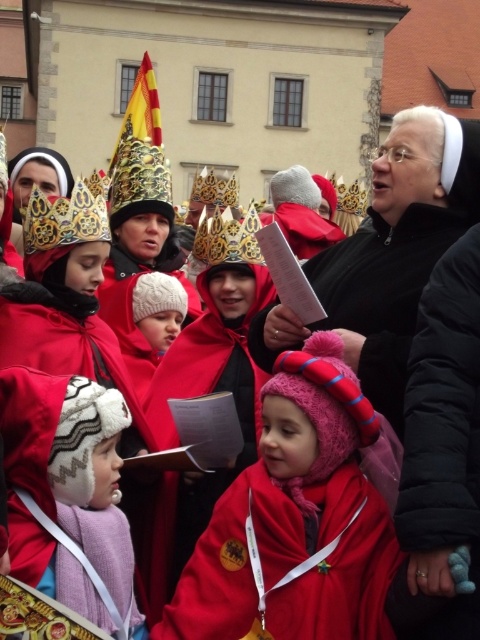
Does fuzzy white hat at lower left have a lesser height compared to gold metallic crown at upper left?

Correct, fuzzy white hat at lower left is not as tall as gold metallic crown at upper left.

Between fuzzy white hat at lower left and gold metallic crown at upper left, which one has less height?

Standing shorter between the two is fuzzy white hat at lower left.

Is point (116, 616) positioned after point (40, 241)?

No, (116, 616) is closer to viewer.

Image resolution: width=480 pixels, height=640 pixels. In order to click on fuzzy white hat at lower left in this screenshot , I will do `click(93, 506)`.

Between point (327, 483) and point (59, 244), which one is positioned behind?

The point (59, 244) is more distant.

Is point (343, 604) positioned after point (69, 211)?

No, it is not.

The height and width of the screenshot is (640, 480). I want to click on fuzzy pink hat at center, so click(300, 524).

Measure the distance between fuzzy pink hat at center and fuzzy white hat at lower left.

fuzzy pink hat at center and fuzzy white hat at lower left are 20.38 feet apart from each other.

Is fuzzy pink hat at center smaller than fuzzy white hat at lower left?

Incorrect, fuzzy pink hat at center is not smaller in size than fuzzy white hat at lower left.

Does point (299, 600) come farther from viewer compared to point (92, 481)?

No, (299, 600) is closer to viewer.

I want to click on fuzzy pink hat at center, so (x=300, y=524).